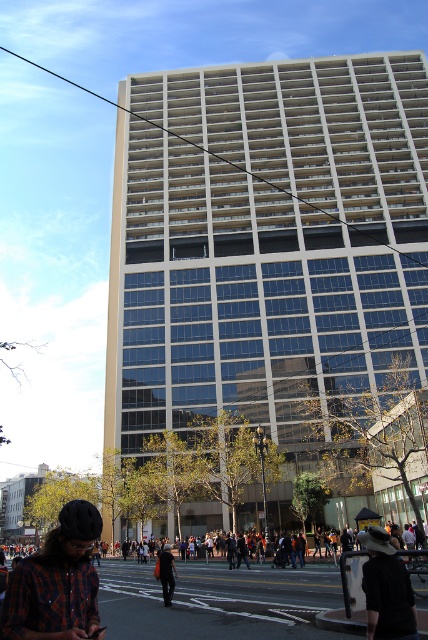
You are a fashion designer observing the urban scene. You notice a plaid flannel shirt at lower left and a black fabric hat at lower right. Which clothing item has a greater width?

The plaid flannel shirt at lower left has a greater width than the black fabric hat at lower right.

You are a photographer trying to capture a detailed shot of the plaid flannel shirt at lower left and the dark blue jeans at center. Since you want both subjects to be clearly visible, which one should you focus on first to ensure proper framing?

The plaid flannel shirt at lower left occupies less space than the dark blue jeans at center, so you should focus on the plaid flasket shirt at lower left first to ensure it is properly framed before adjusting for the larger dark blue jeans at center.

You are a pedestrian standing on the sidewalk near the tall, modern building. You see a person wearing a plaid flannel shirt at lower left and another wearing dark blue jeans at center. Which clothing item is closer to you?

The plaid flannel shirt at lower left is closer to you because it is in front of the dark blue jeans at center.